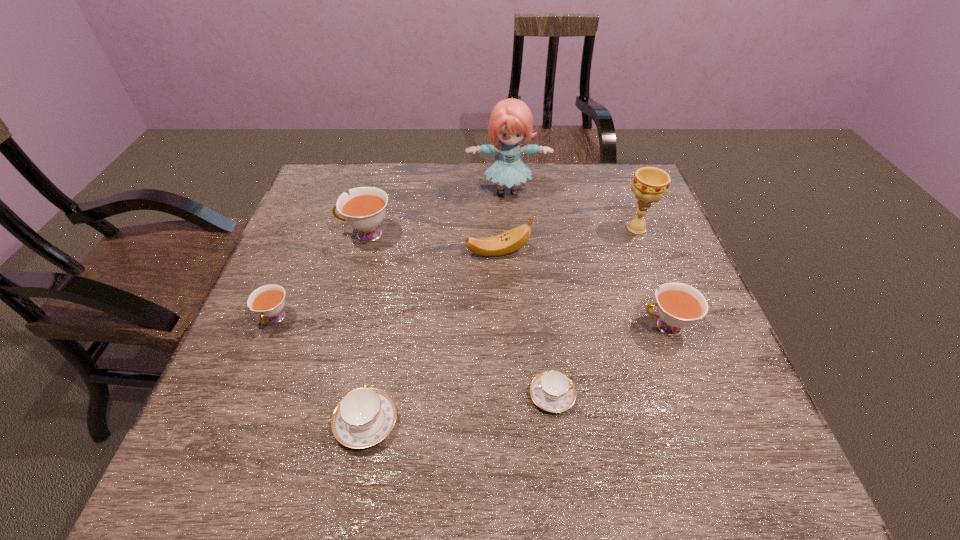
I want to click on white teacup that can be found as the second closest to the leftmost teacup, so click(679, 305).

Find the location of `free point that satisfies the following two spatial constraints: 1. on the front-facing side of the farthest object; 2. on the side of the farthest white teacup with the handle`. free point that satisfies the following two spatial constraints: 1. on the front-facing side of the farthest object; 2. on the side of the farthest white teacup with the handle is located at coordinates (511, 234).

The image size is (960, 540). I want to click on vacant area in the image that satisfies the following two spatial constraints: 1. on the side with the handle of the left blue teacup; 2. on the side of the farthest teacup with the handle, so click(x=401, y=234).

Identify the location of free location that satisfies the following two spatial constraints: 1. on the side of the banana with the handle; 2. on the left side of the second white teacup from left to right. Image resolution: width=960 pixels, height=540 pixels. (362, 252).

The width and height of the screenshot is (960, 540). Identify the location of free space that satisfies the following two spatial constraints: 1. on the side with the handle of the yellow banana; 2. on the left side of the left blue teacup. (398, 252).

You are a GUI agent. You are given a task and a screenshot of the screen. Output one action in this format:
    pyautogui.click(x=<x>, y=<y>)
    Task: Click on the free point that satisfies the following two spatial constraints: 1. on the side of the biggest white teacup with the handle; 2. on the left side of the banana
    
    Given the screenshot: What is the action you would take?
    pyautogui.click(x=362, y=252)